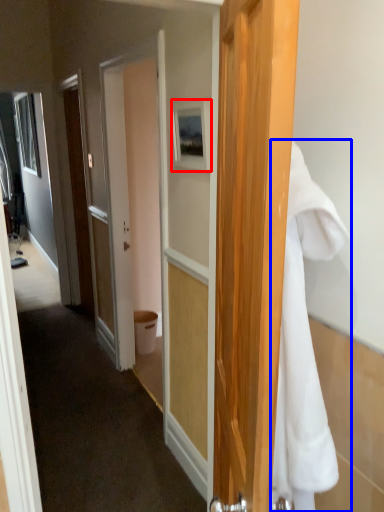
Question: Which of the following is the closest to the observer, picture frame (highlighted by a red box) or towel/napkin (highlighted by a blue box)?

Choices:
 (A) picture frame
 (B) towel/napkin

Answer: (B)